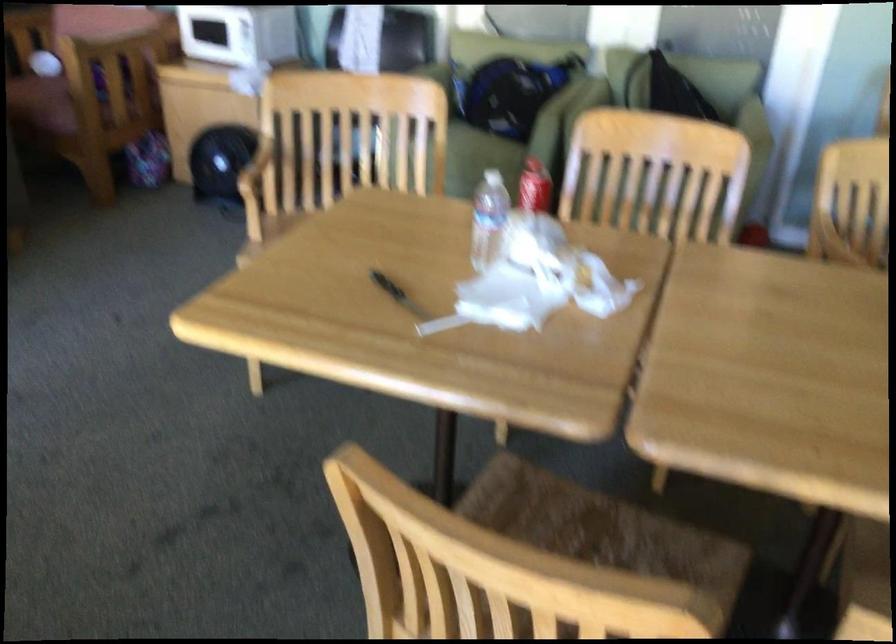
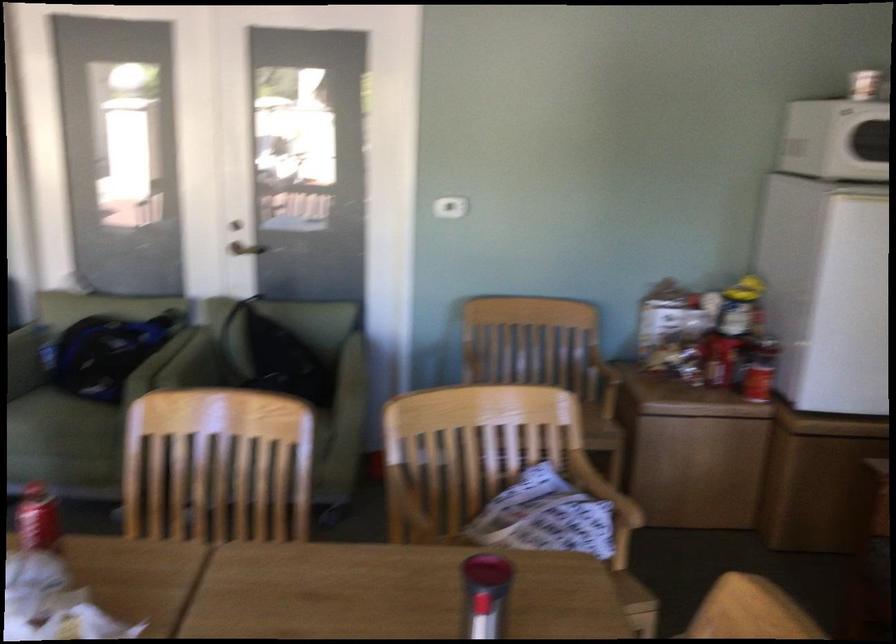
Locate, in the second image, the point that corresponds to point (504, 86) in the first image.

(104, 354)